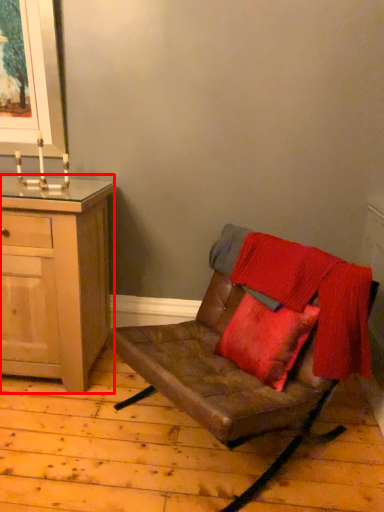
Question: From the image's perspective, what is the correct spatial positioning of cabinetry (annotated by the red box) in reference to chair?

Choices:
 (A) above
 (B) below

Answer: (A)